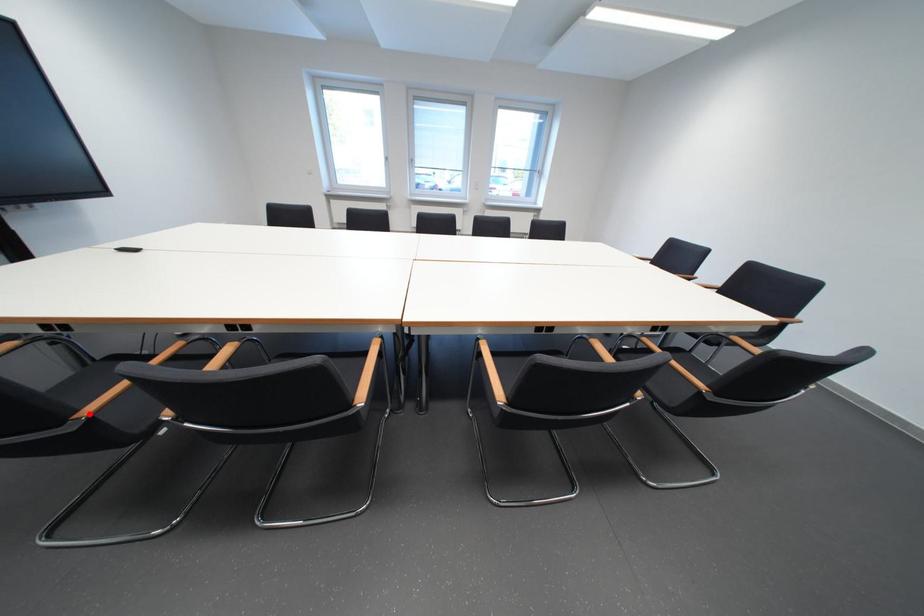
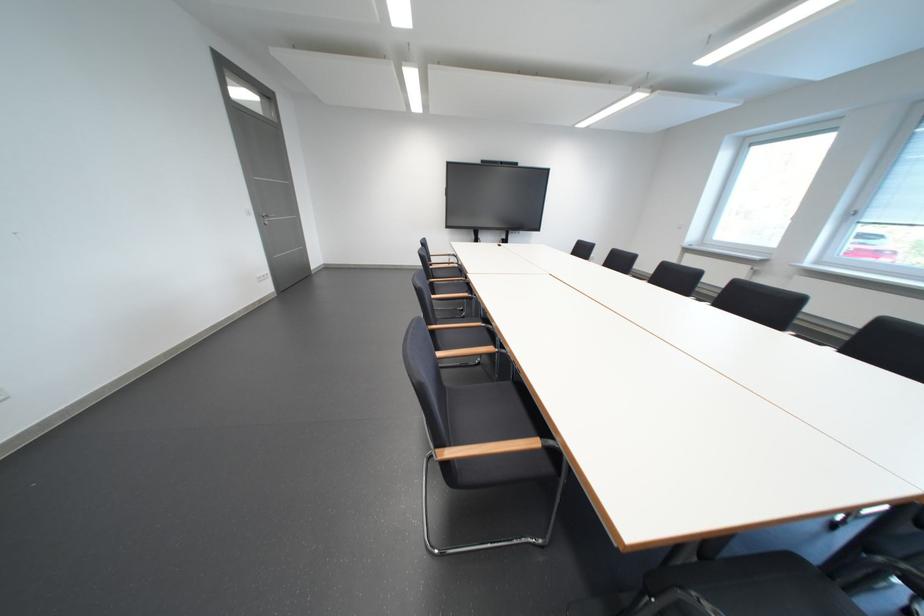
Question: I am providing you with two images of the same scene from different viewpoints. A red point is marked on the first image. At the location where the point appears in image 1, is it still visible in image 2?

Choices:
 (A) Yes
 (B) No

Answer: (B)